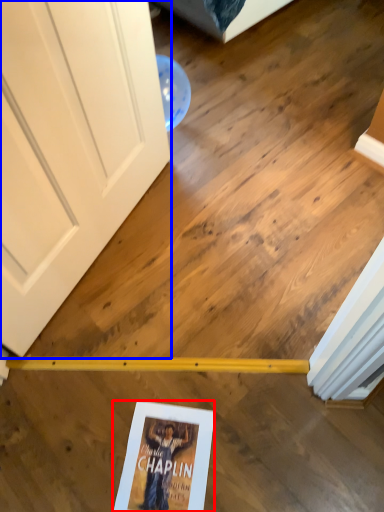
Question: Which object is further to the camera taking this photo, paperback book (highlighted by a red box) or door (highlighted by a blue box)?

Choices:
 (A) paperback book
 (B) door

Answer: (A)